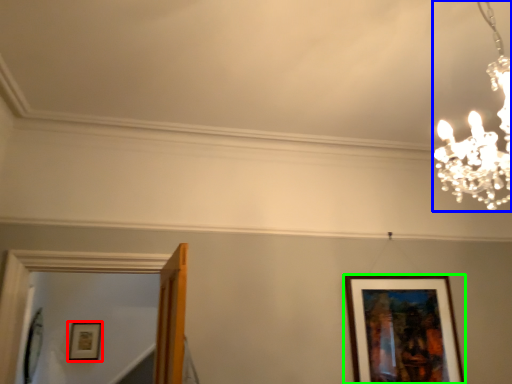
Question: Which object is the closest to the picture frame (highlighted by a red box)? Choose among these: lamp (highlighted by a blue box) or picture frame (highlighted by a green box).

Choices:
 (A) lamp
 (B) picture frame

Answer: (B)